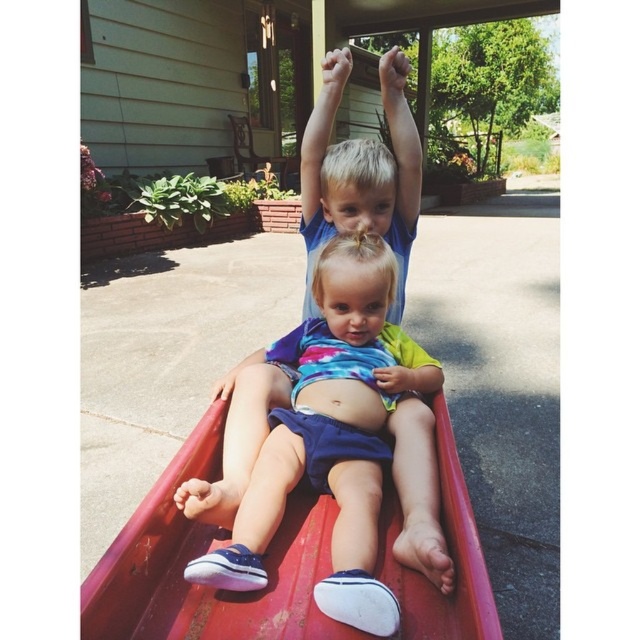
Looking at this image, can you confirm if matte blue shorts at center is thinner than metallic red slide at center?

Indeed, matte blue shorts at center has a lesser width compared to metallic red slide at center.

Where is `matte blue shorts at center`? This screenshot has width=640, height=640. matte blue shorts at center is located at coordinates (339, 438).